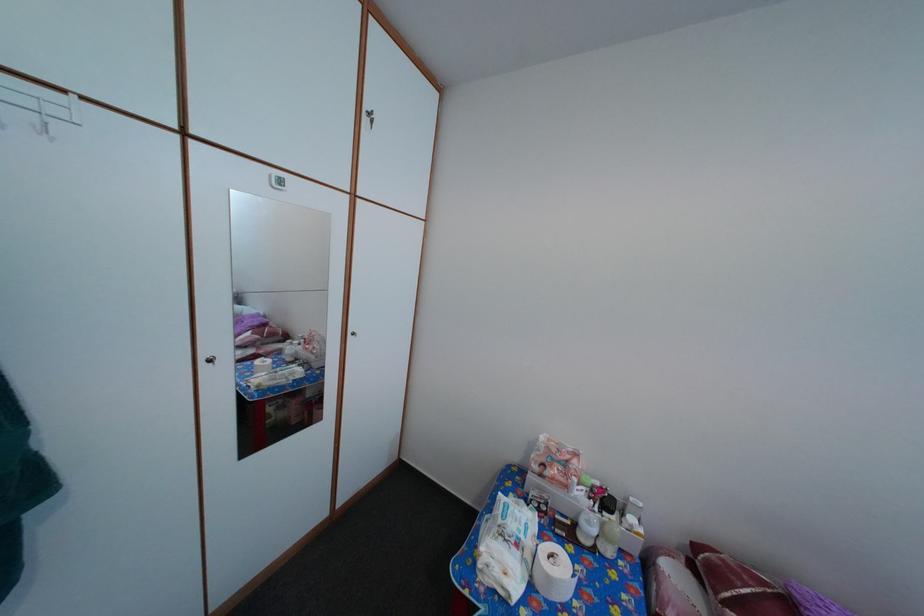
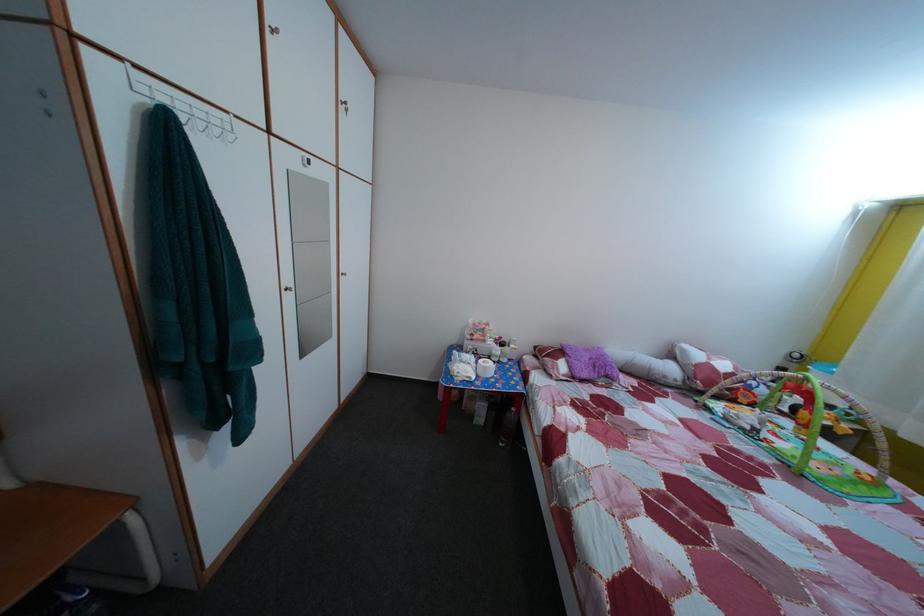
Question: The first image is from the beginning of the video and the second image is from the end. How did the camera likely rotate when shooting the video?

Choices:
 (A) Left
 (B) Right
 (C) Up
 (D) Down

Answer: (B)